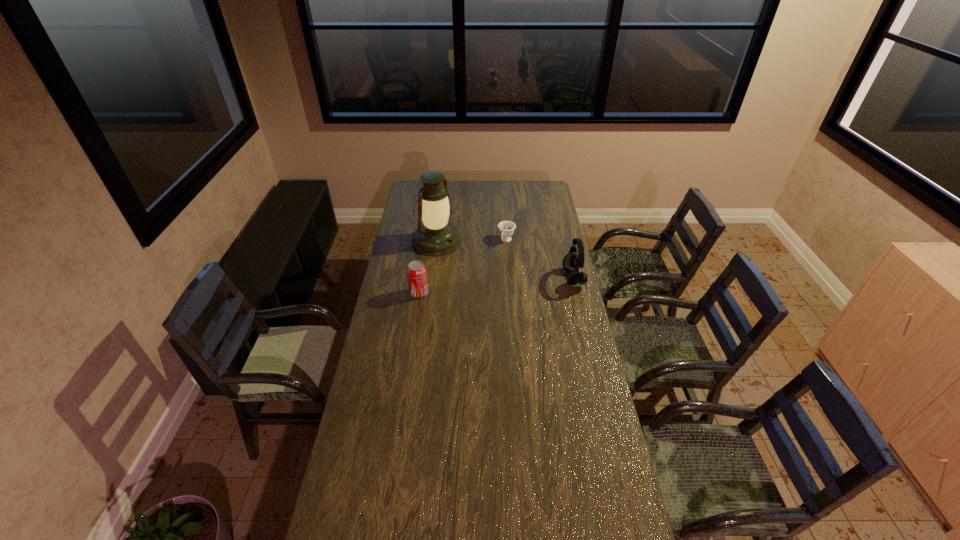
Where is `soda can`? soda can is located at coordinates (417, 275).

In order to click on the second tallest object in this screenshot , I will do `click(573, 263)`.

Locate an element on the screen. The width and height of the screenshot is (960, 540). headset is located at coordinates (573, 263).

Where is `the third object from left to right`? This screenshot has height=540, width=960. the third object from left to right is located at coordinates coord(506,228).

At what (x,y) coordinates should I click in order to perform the action: click on the shortest object. Please return your answer as a coordinate pair (x, y). The width and height of the screenshot is (960, 540). Looking at the image, I should click on pos(506,228).

What are the coordinates of `the tallest object` in the screenshot? It's located at (436, 237).

Find the location of a particular element. The height and width of the screenshot is (540, 960). vacant space located 0.120m on the logo side of the second shortest object is located at coordinates (384, 293).

Locate an element on the screen. The image size is (960, 540). free location located 0.050m on the logo side of the second shortest object is located at coordinates (399, 293).

Find the location of `free space located 0.050m on the logo side of the second shortest object`. free space located 0.050m on the logo side of the second shortest object is located at coordinates (399, 293).

Where is `vacant area situated 0.100m on the ear cups of the third shortest object`? vacant area situated 0.100m on the ear cups of the third shortest object is located at coordinates (541, 279).